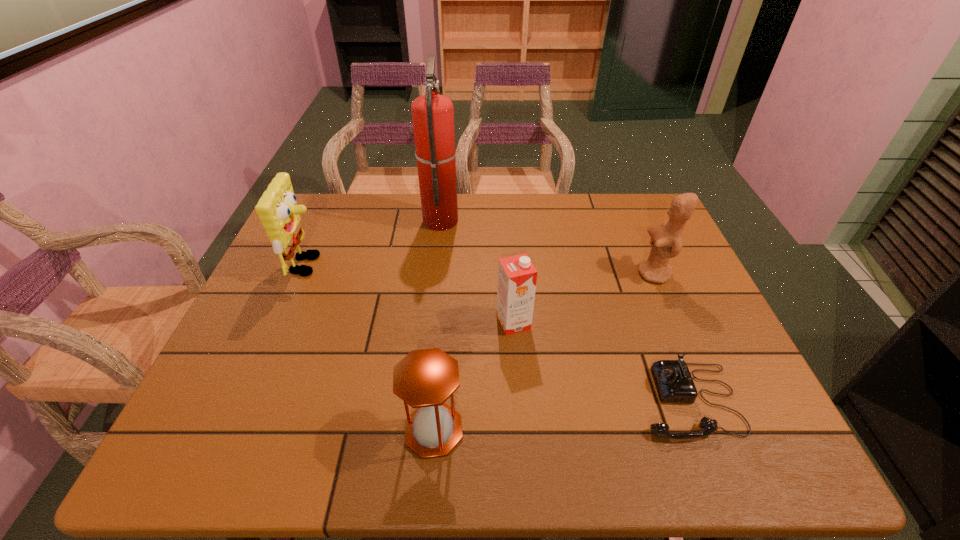
Identify the location of free space between the tallest object and the figurine. pos(547,247).

Locate an element on the screen. The image size is (960, 540). vacant area that lies between the hourglass and the fire extinguisher is located at coordinates (437, 325).

Locate an element on the screen. empty location between the hourglass and the shortest object is located at coordinates (561, 415).

In order to click on vacant point located between the figurine and the fire extinguisher in this screenshot , I will do `click(547, 247)`.

You are a GUI agent. You are given a task and a screenshot of the screen. Output one action in this format:
    pyautogui.click(x=<x>, y=<y>)
    Task: Click on the empty location between the telephone and the fourth object from left to right
    
    Given the screenshot: What is the action you would take?
    pyautogui.click(x=601, y=361)

Where is `free spot between the shortest object and the fourth farthest object`? free spot between the shortest object and the fourth farthest object is located at coordinates (601, 361).

Where is `empty space between the carton and the hourglass`? This screenshot has width=960, height=540. empty space between the carton and the hourglass is located at coordinates (473, 376).

Find the location of a particular element. The width and height of the screenshot is (960, 540). free space between the figurine and the shortest object is located at coordinates (671, 337).

I want to click on unoccupied area between the carton and the hourglass, so click(473, 376).

Point out which object is positioned as the third nearest to the hourglass. Please provide its 2D coordinates. Your answer should be formatted as a tuple, i.e. [(x, y)], where the tuple contains the x and y coordinates of a point satisfying the conditions above.

[(277, 209)]